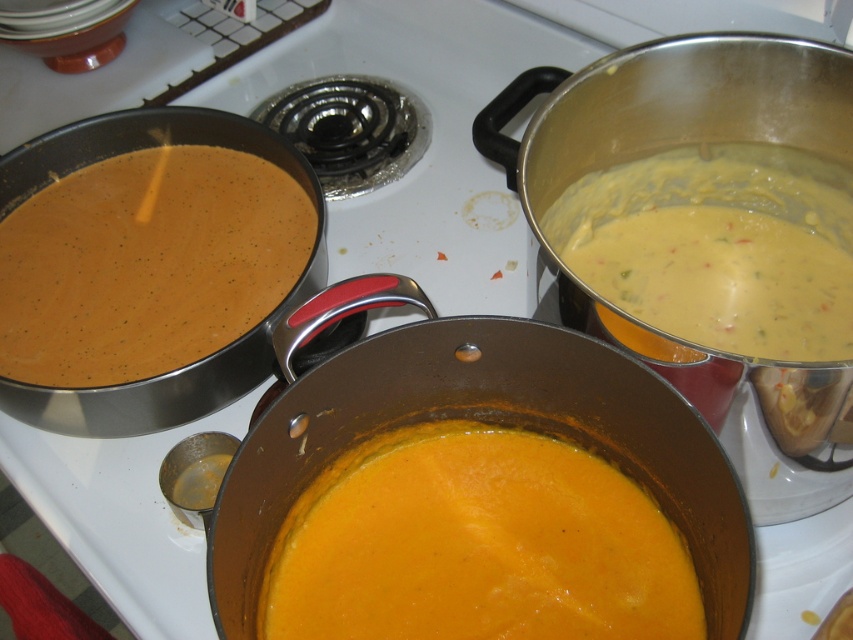
Question: Does matte orange soup at center lie in front of matte stainless steel pot at center?

Choices:
 (A) no
 (B) yes

Answer: (A)

Question: Can you confirm if matte orange soup at center is positioned to the right of yellow creamy soup at upper right?

Choices:
 (A) yes
 (B) no

Answer: (B)

Question: Which point is closer to the camera?

Choices:
 (A) (224, 380)
 (B) (344, 449)

Answer: (B)

Question: Does matte orange soup at center appear on the right side of matte stainless steel pot at center?

Choices:
 (A) yes
 (B) no

Answer: (A)

Question: Which point appears farthest from the camera in this image?

Choices:
 (A) (567, 460)
 (B) (691, 250)
 (C) (285, 513)
 (D) (132, 145)

Answer: (D)

Question: Which of the following is the closest to the observer?

Choices:
 (A) (556, 483)
 (B) (589, 420)
 (C) (820, 202)

Answer: (B)